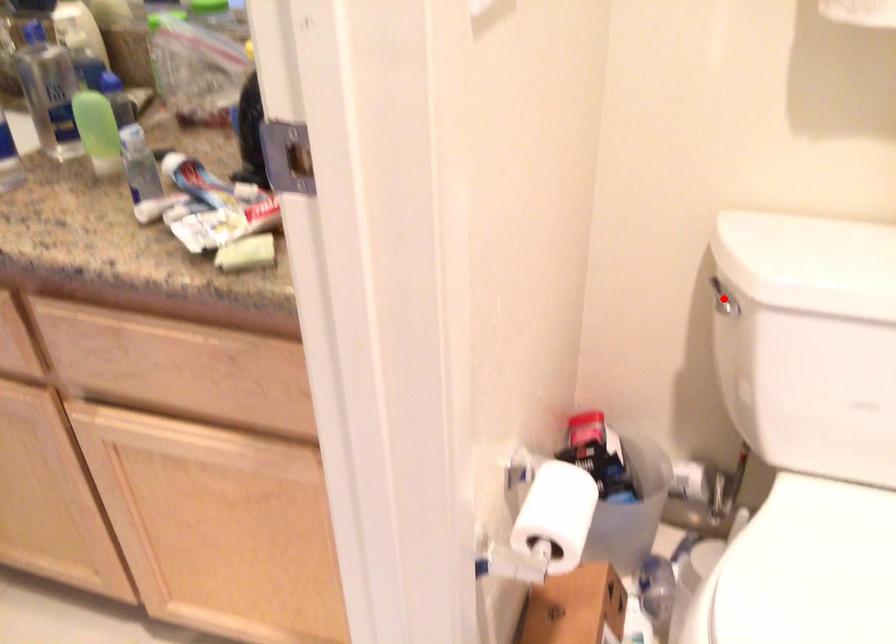
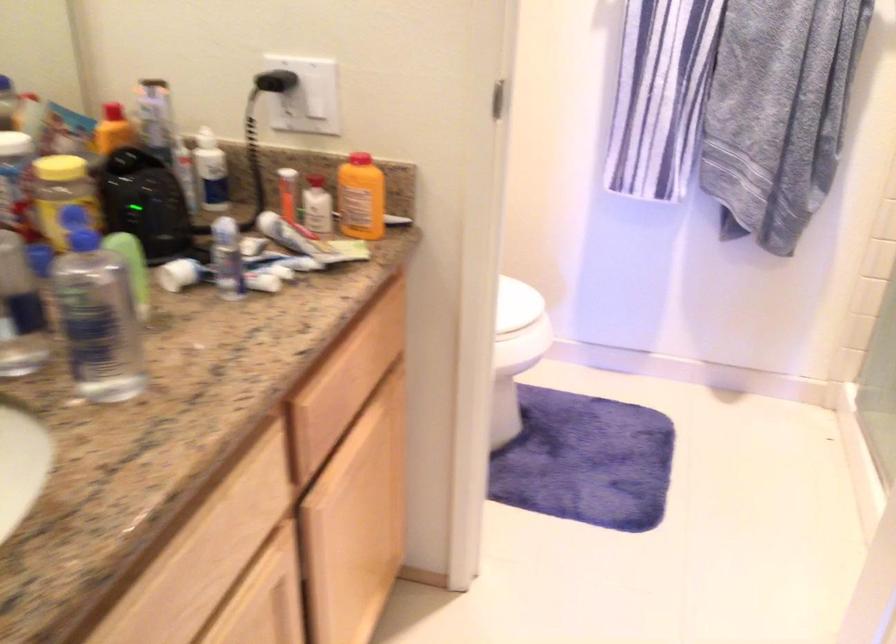
Question: I am providing you with two images of the same scene from different viewpoints. A red point is marked on the first image. At the location where the point appears in image 1, is it still visible in image 2?

Choices:
 (A) Yes
 (B) No

Answer: (B)